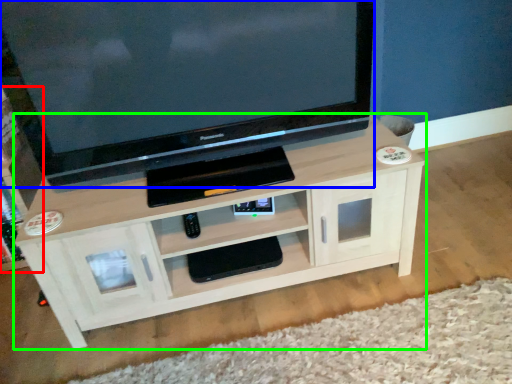
Question: Which object is positioned farthest from tv cabinet (highlighted by a red box)? Select from television (highlighted by a blue box) and shelf (highlighted by a green box).

Choices:
 (A) television
 (B) shelf

Answer: (B)